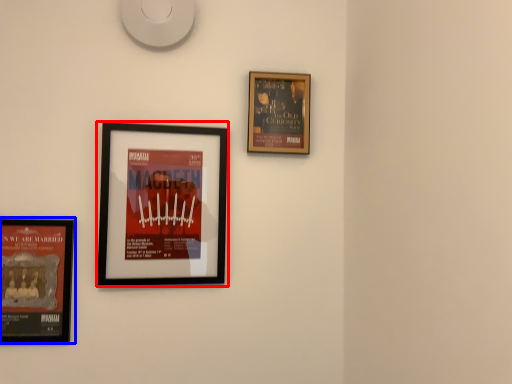
Question: Which object is further to the camera taking this photo, picture frame (highlighted by a red box) or picture frame (highlighted by a blue box)?

Choices:
 (A) picture frame
 (B) picture frame

Answer: (A)